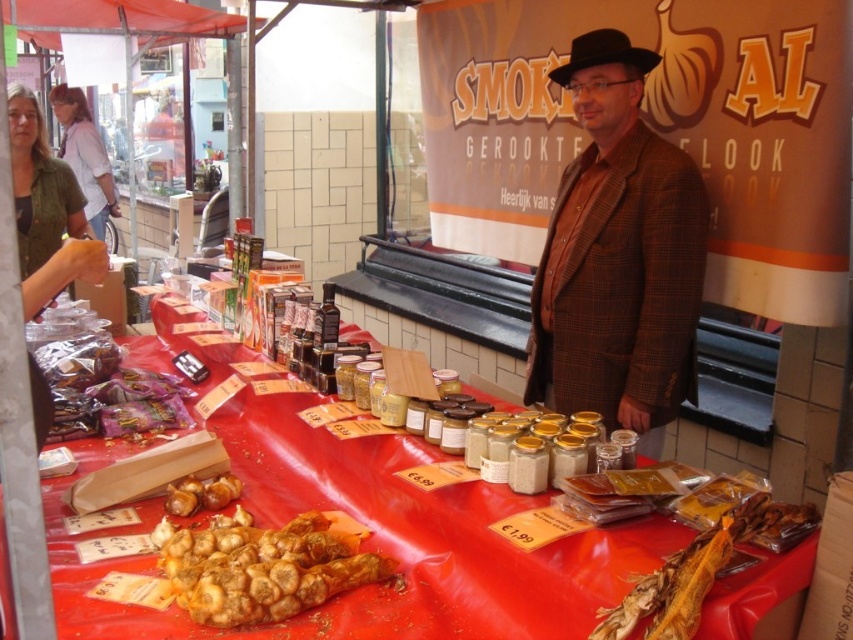
Can you confirm if brown crispy snack at center is thinner than black felt fedora at upper center?

No.

In the scene shown: Can you confirm if brown crispy snack at center is bigger than black felt fedora at upper center?

Yes, brown crispy snack at center is bigger than black felt fedora at upper center.

Where is `brown crispy snack at center`? brown crispy snack at center is located at coordinates [260, 568].

Between point (45, 259) and point (570, 44), which one is positioned in front?

Positioned in front is point (570, 44).

Can you confirm if green fabric shirt at upper left is thinner than black felt fedora at upper center?

Yes.

Is point (36, 196) positioned behind point (585, 61)?

Yes, it is behind point (585, 61).

Locate an element on the screen. Image resolution: width=853 pixels, height=640 pixels. green fabric shirt at upper left is located at coordinates (45, 211).

The height and width of the screenshot is (640, 853). What do you see at coordinates (260, 568) in the screenshot?
I see `brown crispy snack at center` at bounding box center [260, 568].

Is brown crispy snack at center thinner than green fabric shirt at upper left?

Incorrect, brown crispy snack at center's width is not less than green fabric shirt at upper left's.

Who is more distant from viewer, (227, 524) or (18, 100)?

The point (18, 100) is behind.

Find the location of a particular element. Image resolution: width=853 pixels, height=640 pixels. brown crispy snack at center is located at coordinates (260, 568).